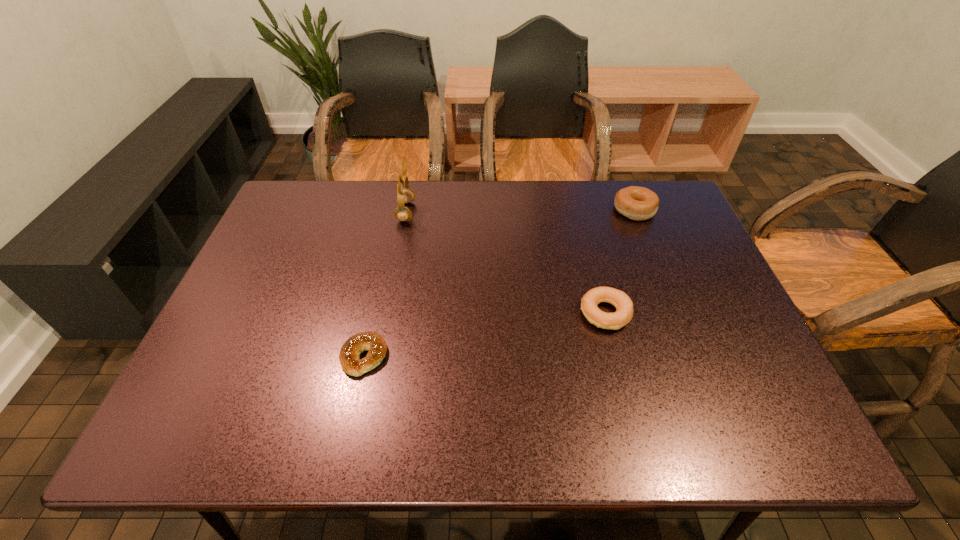
In order to click on vacant space that's between the third tallest object and the nearest object in this screenshot , I will do `click(485, 335)`.

The height and width of the screenshot is (540, 960). Find the location of `vacant area that lies between the second bagel from left to right and the second tallest object`. vacant area that lies between the second bagel from left to right and the second tallest object is located at coordinates (619, 262).

The width and height of the screenshot is (960, 540). In order to click on free spot between the leftmost bagel and the third tallest object in this screenshot , I will do `click(485, 335)`.

Identify the location of vacant area between the tallest bagel and the nearest object. This screenshot has width=960, height=540. (499, 283).

You are a GUI agent. You are given a task and a screenshot of the screen. Output one action in this format:
    pyautogui.click(x=<x>, y=<y>)
    Task: Click on the vacant area between the third tallest object and the leftmost bagel
    
    Given the screenshot: What is the action you would take?
    pyautogui.click(x=485, y=335)

I want to click on free area in between the nearest object and the tallest object, so click(385, 284).

This screenshot has height=540, width=960. In order to click on free space between the rightmost object and the third object from left to right in this screenshot , I will do pos(619,262).

At what (x,y) coordinates should I click in order to perform the action: click on unoccupied position between the second shortest object and the rightmost bagel. Please return your answer as a coordinate pair (x, y). This screenshot has height=540, width=960. Looking at the image, I should click on (619, 262).

You are a GUI agent. You are given a task and a screenshot of the screen. Output one action in this format:
    pyautogui.click(x=<x>, y=<y>)
    Task: Click on the unoccupied area between the earphone and the shortest bagel
    This screenshot has height=540, width=960.
    Given the screenshot: What is the action you would take?
    pyautogui.click(x=385, y=284)

The width and height of the screenshot is (960, 540). Identify the location of free spot between the rightmost object and the earphone. (520, 211).